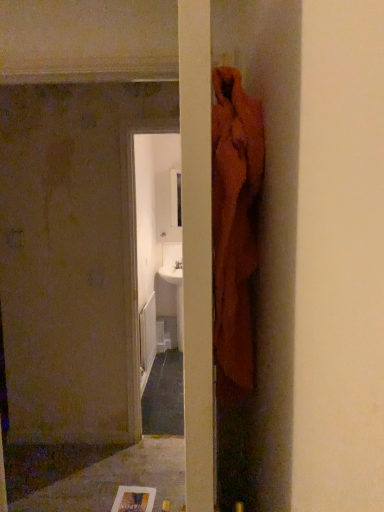
Question: Looking at their shapes, would you say white glossy sink at center is wider or thinner than smooth gray concrete at lower left?

Choices:
 (A) wide
 (B) thin

Answer: (B)

Question: From the image's perspective, is white glossy sink at center positioned above or below smooth gray concrete at lower left?

Choices:
 (A) below
 (B) above

Answer: (B)

Question: Would you say white glossy sink at center is inside or outside smooth gray concrete at lower left?

Choices:
 (A) inside
 (B) outside

Answer: (B)

Question: From a real-world perspective, is smooth gray concrete at lower left positioned above or below white glossy sink at center?

Choices:
 (A) above
 (B) below

Answer: (B)

Question: Is smooth gray concrete at lower left bigger or smaller than white glossy sink at center?

Choices:
 (A) small
 (B) big

Answer: (A)

Question: In the image, is smooth gray concrete at lower left positioned in front of or behind white glossy sink at center?

Choices:
 (A) front
 (B) behind

Answer: (A)

Question: Is smooth gray concrete at lower left inside or outside of white glossy sink at center?

Choices:
 (A) inside
 (B) outside

Answer: (B)